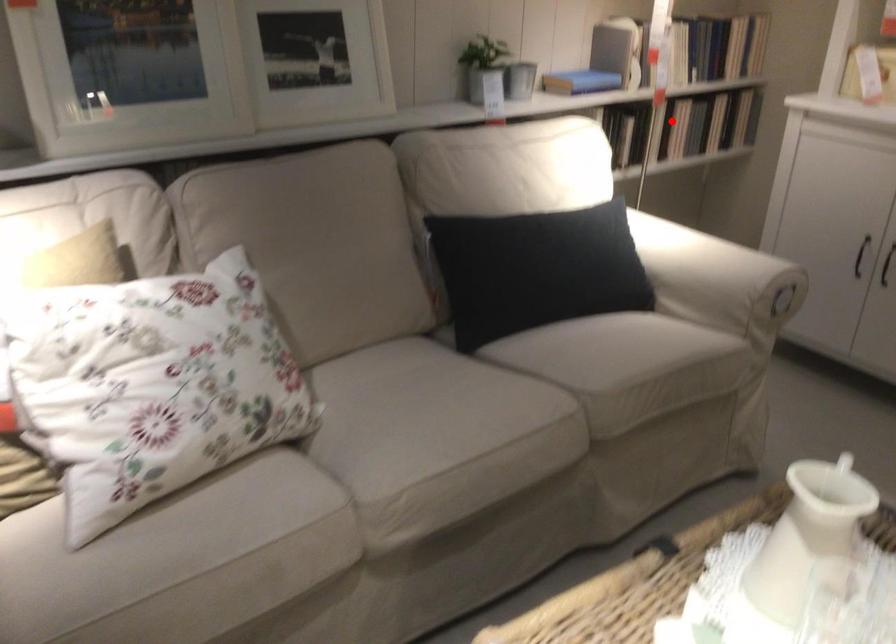
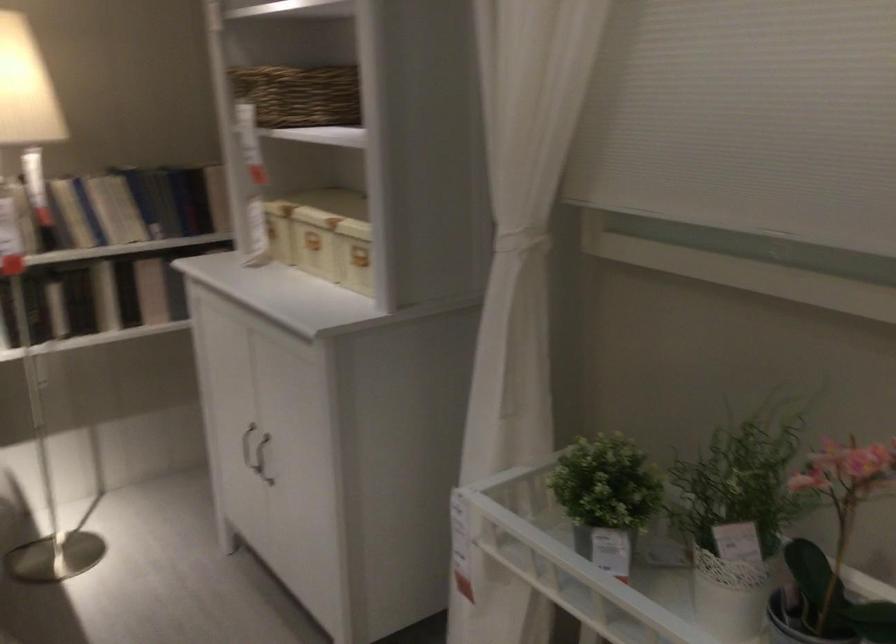
In the second image, find the point that corresponds to the highlighted location in the first image.

(105, 296)